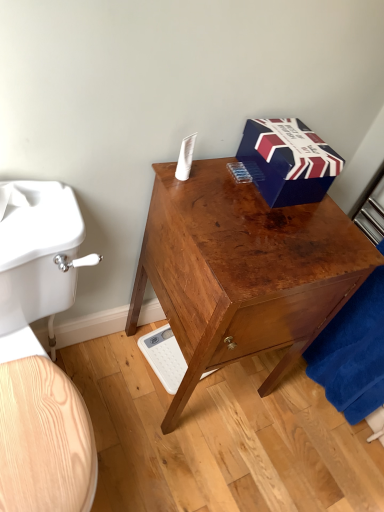
Find the location of a particular element. This screenshot has height=512, width=384. vacant position to the left of white plastic scale at lower center is located at coordinates (124, 357).